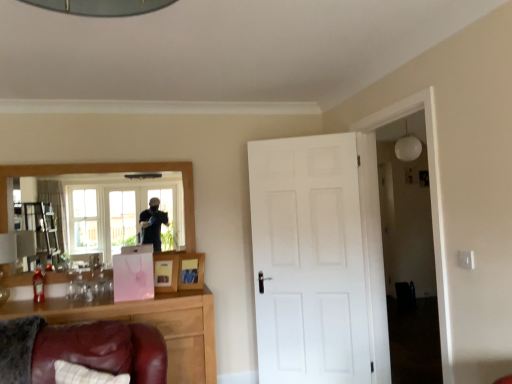
Question: Is wooden photo frame at center, the first picture frame viewed from the right, wider than wooden framed mirror at upper left?

Choices:
 (A) yes
 (B) no

Answer: (A)

Question: Considering the relative sizes of wooden photo frame at center, the first picture frame viewed from the right, and wooden framed mirror at upper left in the image provided, is wooden photo frame at center, the first picture frame viewed from the right, taller than wooden framed mirror at upper left?

Choices:
 (A) no
 (B) yes

Answer: (A)

Question: Considering the relative sizes of wooden photo frame at center, the first picture frame viewed from the right, and wooden framed mirror at upper left in the image provided, is wooden photo frame at center, the first picture frame viewed from the right, thinner than wooden framed mirror at upper left?

Choices:
 (A) no
 (B) yes

Answer: (A)

Question: Would you say wooden photo frame at center, the first picture frame viewed from the right, contains wooden framed mirror at upper left?

Choices:
 (A) yes
 (B) no

Answer: (B)

Question: Is wooden photo frame at center, which is the second picture frame from left to right, smaller than wooden framed mirror at upper left?

Choices:
 (A) no
 (B) yes

Answer: (B)

Question: From the image's perspective, is white matte door at center located above or below white matte light fixture at upper right?

Choices:
 (A) below
 (B) above

Answer: (A)

Question: Visually, is white matte door at center positioned to the left or to the right of white matte light fixture at upper right?

Choices:
 (A) left
 (B) right

Answer: (A)

Question: In terms of size, does white matte door at center appear bigger or smaller than white matte light fixture at upper right?

Choices:
 (A) small
 (B) big

Answer: (B)

Question: Is point (339, 142) closer or farther from the camera than point (417, 142)?

Choices:
 (A) farther
 (B) closer

Answer: (B)

Question: In terms of size, does white matte light fixture at upper right appear bigger or smaller than wooden photo frame at center, which is the second picture frame from left to right?

Choices:
 (A) small
 (B) big

Answer: (B)

Question: Considering their positions, is white matte light fixture at upper right located in front of or behind wooden photo frame at center, the first picture frame viewed from the right?

Choices:
 (A) behind
 (B) front

Answer: (A)

Question: Is point (415, 140) closer or farther from the camera than point (186, 274)?

Choices:
 (A) farther
 (B) closer

Answer: (A)

Question: Based on their positions, is white matte light fixture at upper right located to the left or right of wooden photo frame at center, the first picture frame viewed from the right?

Choices:
 (A) left
 (B) right

Answer: (B)

Question: Is pink paper picture frame at center, the 1th picture frame from the left, in front of or behind white matte light fixture at upper right in the image?

Choices:
 (A) front
 (B) behind

Answer: (A)

Question: Does point (162, 266) appear closer or farther from the camera than point (416, 155)?

Choices:
 (A) closer
 (B) farther

Answer: (A)